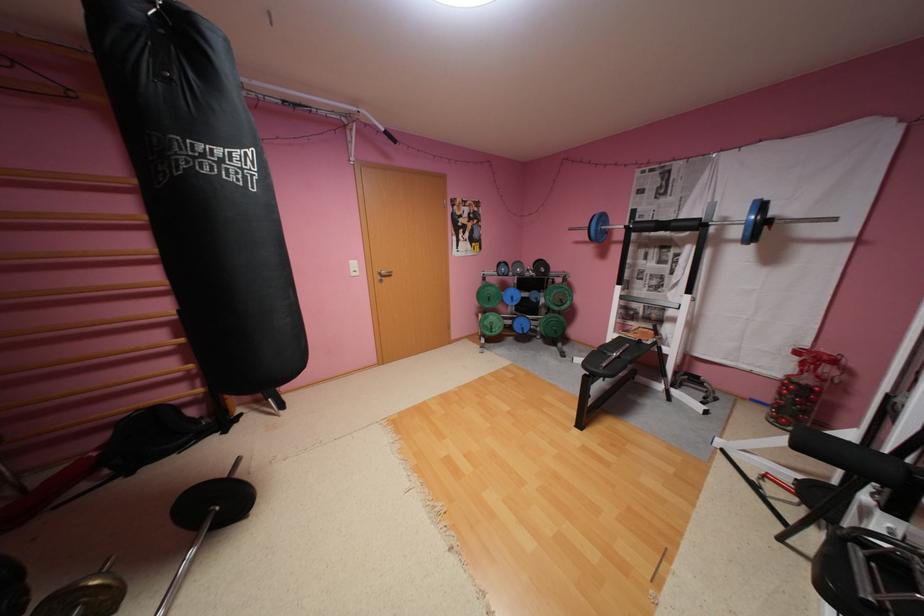
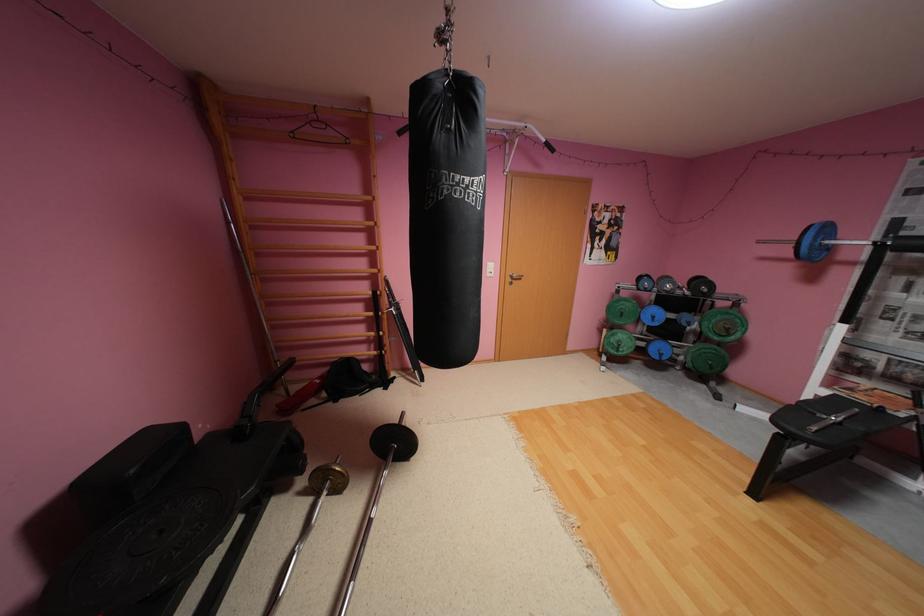
Locate, in the second image, the point that corresponds to point 227,150 in the first image.

(477, 179)